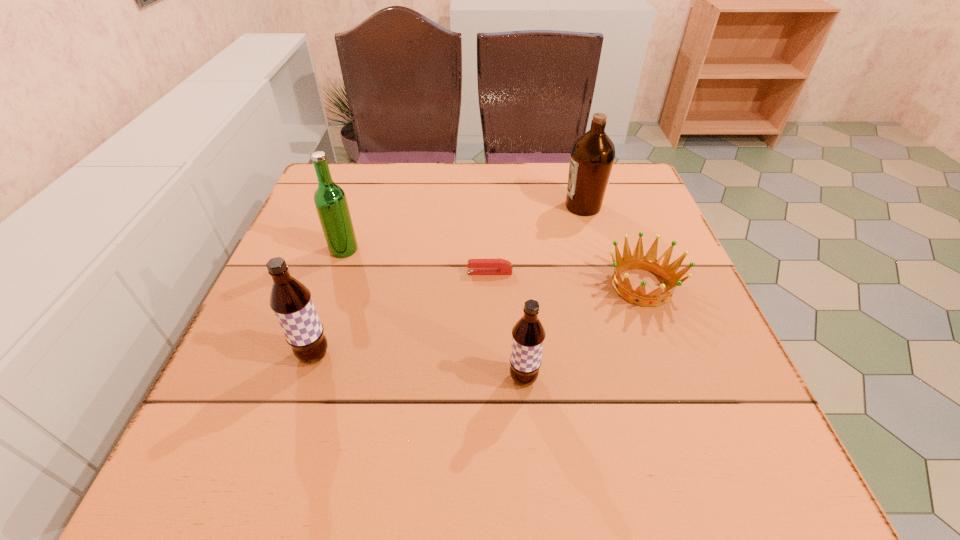
In the current image, all root beers are evenly spaced. To maintain this equal spacing, where should an additional root beer be placed on the right? Please point out a free spot. Please provide its 2D coordinates. Your answer should be formatted as a tuple, i.e. [(x, y)], where the tuple contains the x and y coordinates of a point satisfying the conditions above.

[(754, 404)]